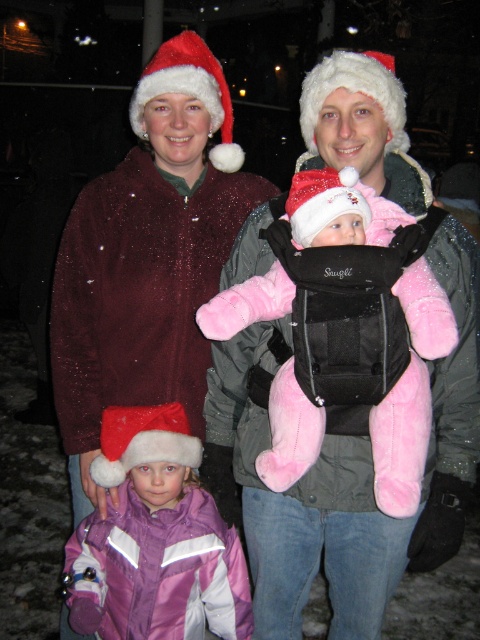
You are trying to decide which item to place in a small gift box that can only hold items up to the size of the pink plush baby at center. Can the sparkly maroon coat at center fit into the box?

The sparkly maroon coat at center is larger than the pink plush baby at center, so it cannot fit into the small gift box designed for items up to the size of the pink plush baby at center.

You are a photographer trying to capture the family photo. You notice the pink plush baby carrier at center and the pink plush baby at center. Which object should you focus on first if you want to ensure both are in the frame without moving the camera? Explain your reasoning based on their positions.

The pink plush baby at center should be focused on first because it is positioned to the left of the pink plush baby carrier at center. By centering the camera on the baby, the carrier, being to the right, will naturally fall within the frame without needing to adjust the camera position.